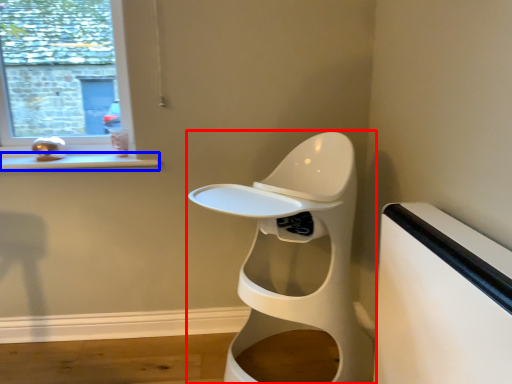
Question: Among these objects, which one is nearest to the camera, toilet (highlighted by a red box) or window sill (highlighted by a blue box)?

Choices:
 (A) toilet
 (B) window sill

Answer: (A)